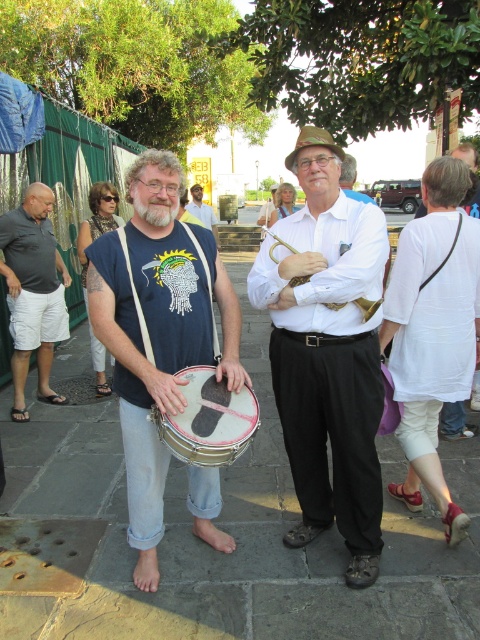
Who is taller, gray stone pavement at center or white metallic drum at center?

white metallic drum at center is taller.

Can you confirm if gray stone pavement at center is positioned above white metallic drum at center?

Incorrect, gray stone pavement at center is not positioned above white metallic drum at center.

This screenshot has width=480, height=640. Identify the location of gray stone pavement at center. (235, 538).

From the picture: Can you confirm if white metallic drum at center is positioned to the left of matte blue shirt at center?

No, white metallic drum at center is not to the left of matte blue shirt at center.

Is point (225, 452) positioned in front of point (204, 211)?

Yes, it is.

The height and width of the screenshot is (640, 480). I want to click on white metallic drum at center, so click(208, 419).

Does white cotton shirt at center come in front of matte white shirt at center?

Yes, white cotton shirt at center is in front of matte white shirt at center.

Find the location of `white cotton shirt at center`. white cotton shirt at center is located at coordinates point(327,353).